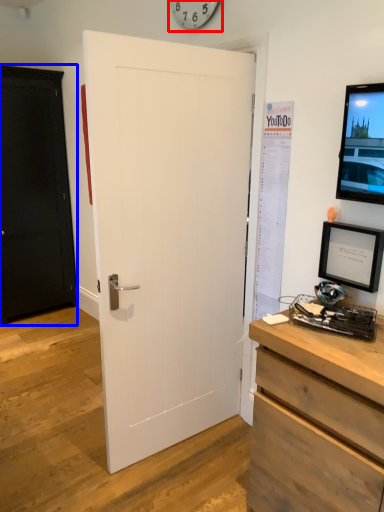
Question: Which object appears closest to the camera in this image, clock (highlighted by a red box) or door (highlighted by a blue box)?

Choices:
 (A) clock
 (B) door

Answer: (A)